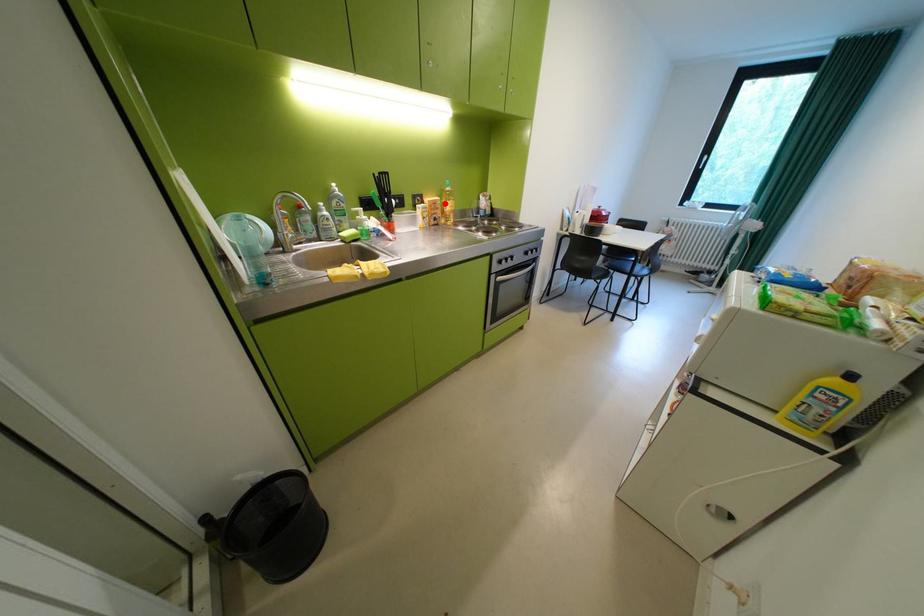
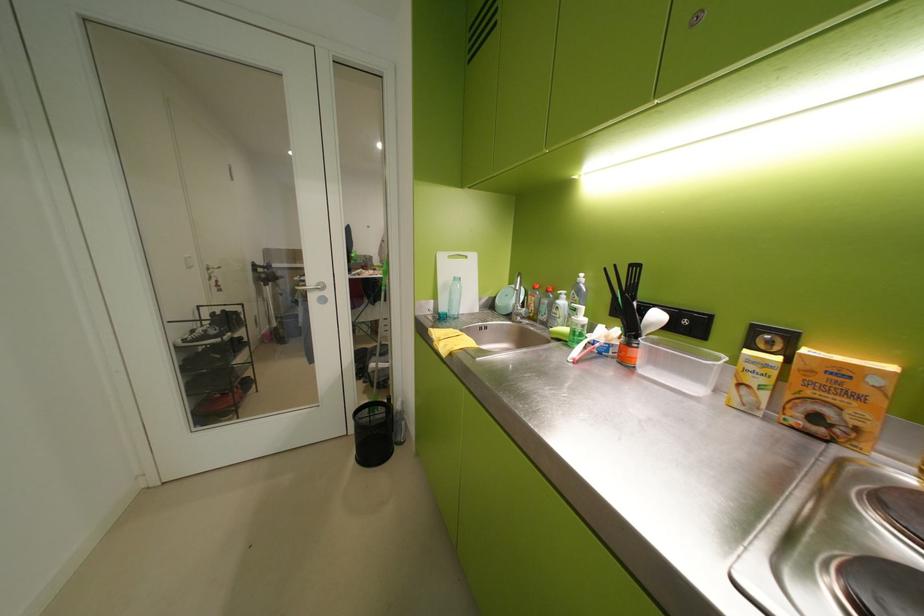
Question: I am providing you with two images of the same scene from different viewpoints. In image1, a red point is highlighted. Considering the same 3D point in image2, which of the following is correct?

Choices:
 (A) It is closer
 (B) It is farther

Answer: (B)